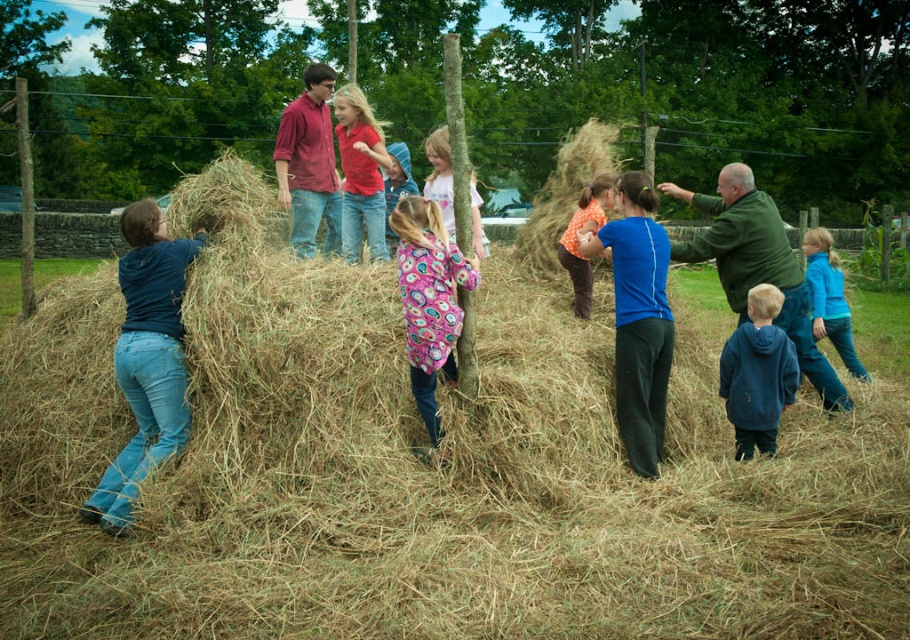
Question: Considering the relative positions of matte red shirt at center and floral fabric dress at center in the image provided, where is matte red shirt at center located with respect to floral fabric dress at center?

Choices:
 (A) below
 (B) above

Answer: (A)

Question: Based on their relative distances, which object is farther from the blue fleece jacket at right?

Choices:
 (A) floral-patterned fleece jacket at center
 (B) blue fleece jacket at lower right

Answer: (A)

Question: Observing the image, what is the correct spatial positioning of floral-patterned fleece jacket at center in reference to matte red shirt at center?

Choices:
 (A) below
 (B) above

Answer: (A)

Question: Which point is closer to the camera?

Choices:
 (A) (451, 172)
 (B) (123, 522)
 (C) (392, 220)

Answer: (B)

Question: Among these points, which one is nearest to the camera?

Choices:
 (A) (582, 221)
 (B) (835, 276)
 (C) (375, 221)

Answer: (A)

Question: Where is blue fleece jacket at lower right located in relation to orange cotton shirt at center in the image?

Choices:
 (A) right
 (B) left

Answer: (A)